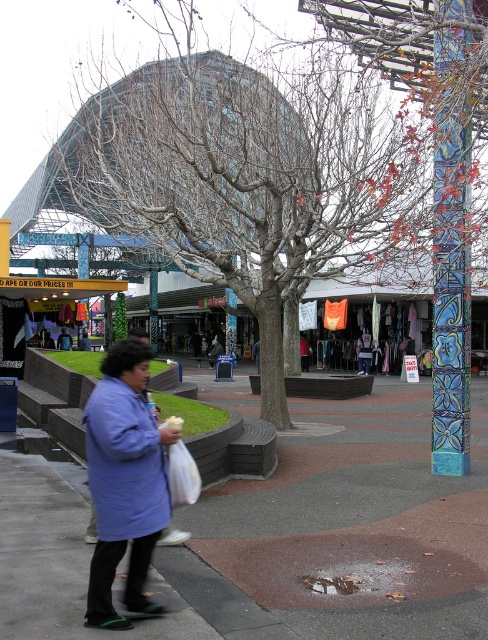
Question: In this image, where is multicolored mosaic pillar at right located relative to dark blue shirt at center?

Choices:
 (A) below
 (B) above

Answer: (B)

Question: Estimate the real-world distances between objects in this image. Which object is farther from the concrete sidewalk at center?

Choices:
 (A) blue fabric coat at lower left
 (B) dark blue shirt at center
 (C) multicolored mosaic pillar at right
 (D) bare wood tree at center

Answer: (B)

Question: Is bare wood tree at center wider than blue fabric coat at lower left?

Choices:
 (A) yes
 (B) no

Answer: (A)

Question: Which of these objects is positioned closest to the concrete sidewalk at center?

Choices:
 (A) bare wood tree at center
 (B) multicolored mosaic pillar at right
 (C) dark blue shirt at center

Answer: (B)

Question: Does blue fabric coat at lower left have a larger size compared to dark blue shirt at center?

Choices:
 (A) no
 (B) yes

Answer: (B)

Question: Which of the following is the farthest from the observer?

Choices:
 (A) (100, 132)
 (B) (148, 468)
 (C) (443, 250)

Answer: (A)